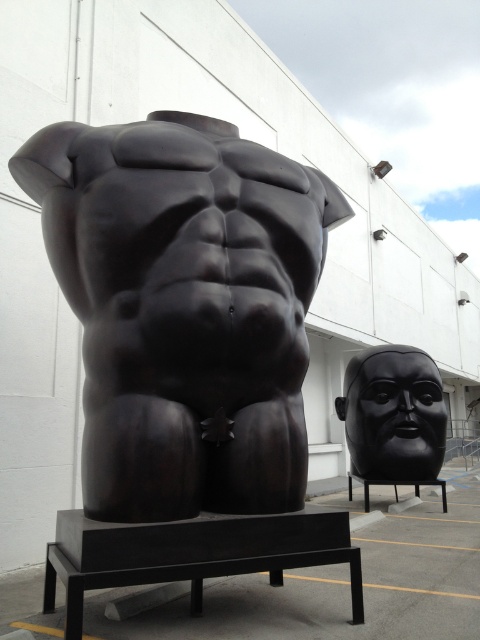
Question: Is black glossy mask at right in front of black metal bench at lower right?

Choices:
 (A) no
 (B) yes

Answer: (A)

Question: From the image, what is the correct spatial relationship of matte black bench at center in relation to black metal bench at lower right?

Choices:
 (A) left
 (B) right

Answer: (A)

Question: Which of the following is the farthest from the observer?

Choices:
 (A) glossy black torso at center
 (B) matte black bench at center
 (C) black glossy mask at right
 (D) black metal bench at lower right

Answer: (C)

Question: Which of the following is the closest to the observer?

Choices:
 (A) glossy black torso at center
 (B) black metal bench at lower right
 (C) black glossy mask at right
 (D) matte black bench at center

Answer: (D)

Question: Which is nearer to the black glossy mask at right?

Choices:
 (A) glossy black torso at center
 (B) matte black bench at center

Answer: (A)

Question: Does glossy black torso at center have a larger size compared to matte black bench at center?

Choices:
 (A) no
 (B) yes

Answer: (B)